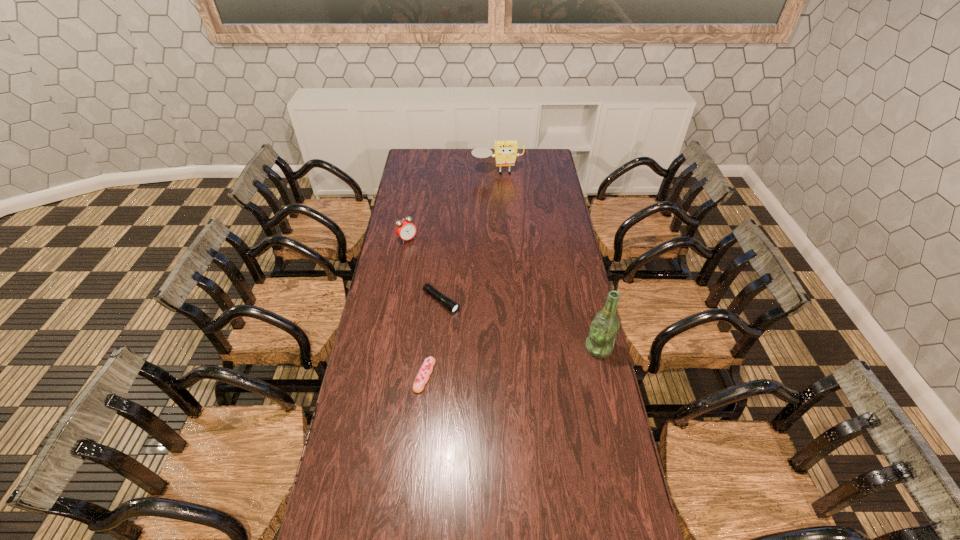
This screenshot has width=960, height=540. I want to click on free location that satisfies the following two spatial constraints: 1. on the front side of the beer bottle; 2. on the surface of the alarm clock, so click(x=388, y=348).

You are a GUI agent. You are given a task and a screenshot of the screen. Output one action in this format:
    pyautogui.click(x=<x>, y=<y>)
    Task: Click on the vacant space that satisfies the following two spatial constraints: 1. on the back side of the eclair; 2. on the surface of the tallest object
    This screenshot has height=540, width=960.
    Given the screenshot: What is the action you would take?
    (427, 348)